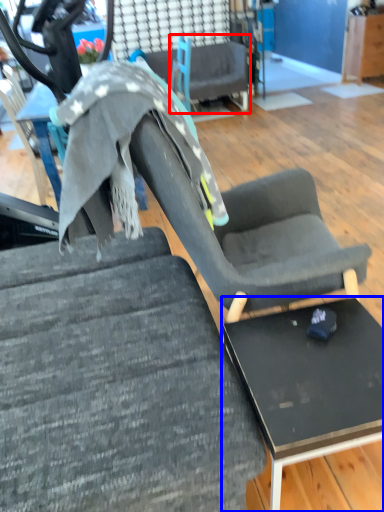
Question: Among these objects, which one is nearest to the camera, chair (highlighted by a red box) or table (highlighted by a blue box)?

Choices:
 (A) chair
 (B) table

Answer: (B)